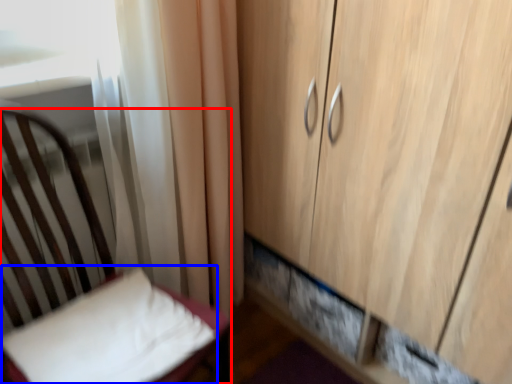
Question: Which of the following is the farthest to the observer, furniture (highlighted by a red box) or pillow (highlighted by a blue box)?

Choices:
 (A) furniture
 (B) pillow

Answer: (B)